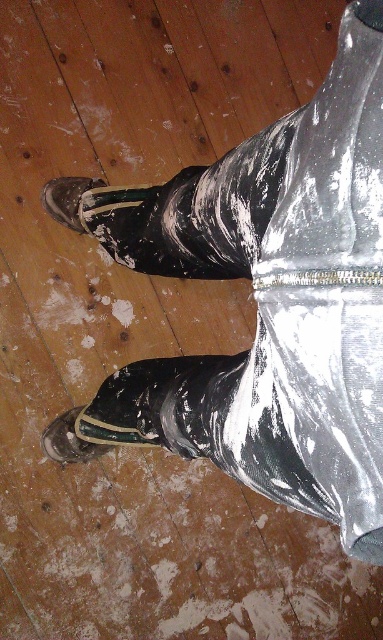
Measure the distance between shiny black shoe at lower left and matte black shoe at lower left.

shiny black shoe at lower left is 16.88 inches from matte black shoe at lower left.

Can you confirm if shiny black shoe at lower left is shorter than matte black shoe at lower left?

Correct, shiny black shoe at lower left is not as tall as matte black shoe at lower left.

Consider the image. Who is more distant from viewer, (63,435) or (65,208)?

The point (63,435) is more distant.

I want to click on shiny black shoe at lower left, so click(70, 440).